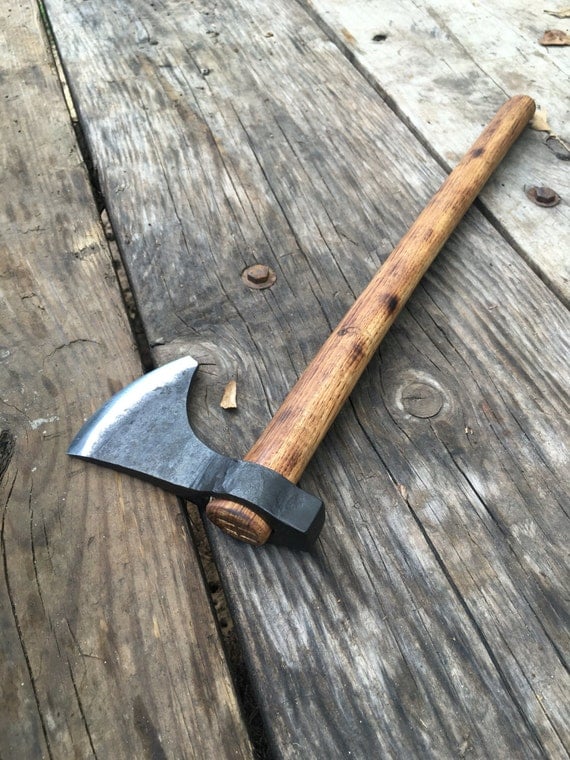
The image size is (570, 760). Identify the location of wood floor. (200, 119).